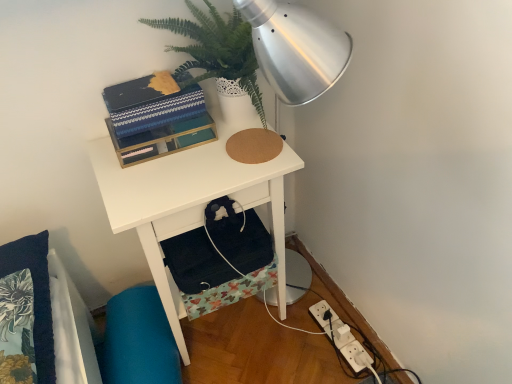
I want to click on vacant space in front of matte black book at upper center, so click(x=161, y=178).